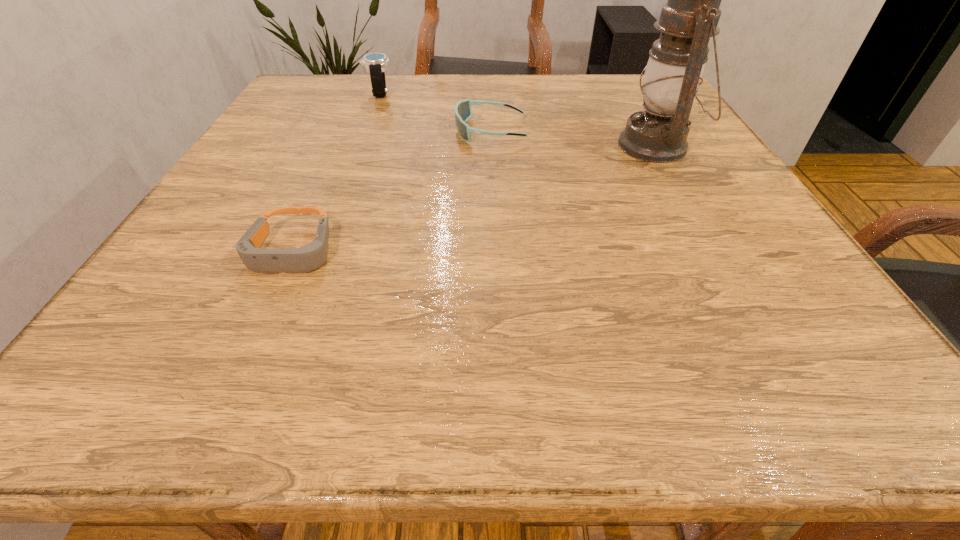
Locate an element on the screen. The image size is (960, 540). vacant region at the right edge of the desktop is located at coordinates (677, 173).

Where is `vacant area at the far left corner`? This screenshot has height=540, width=960. vacant area at the far left corner is located at coordinates (331, 76).

In the image, there is a desktop. Where is `free space at the near right corner`? free space at the near right corner is located at coordinates (790, 375).

You are a GUI agent. You are given a task and a screenshot of the screen. Output one action in this format:
    pyautogui.click(x=<x>, y=<y>)
    Task: Click on the vacant space that's between the shorter goggles and the second object from right to left
    
    Given the screenshot: What is the action you would take?
    pyautogui.click(x=392, y=191)

Where is `unoccupied area between the farther goggles and the oil lamp`? The image size is (960, 540). unoccupied area between the farther goggles and the oil lamp is located at coordinates (573, 138).

This screenshot has width=960, height=540. Identify the location of free space between the second tallest object and the second object from right to left. (435, 112).

Locate an element on the screen. The image size is (960, 540). vacant area that lies between the rightmost object and the shortest object is located at coordinates (474, 198).

Locate an element on the screen. This screenshot has height=540, width=960. empty space between the shortest object and the oil lamp is located at coordinates (474, 198).

At what (x,y) coordinates should I click in order to perform the action: click on empty space that is in between the farthest object and the farther goggles. Please return your answer as a coordinate pair (x, y). Looking at the image, I should click on (435, 112).

Identify the location of free space between the rightmost object and the right goggles. The width and height of the screenshot is (960, 540). (573, 138).